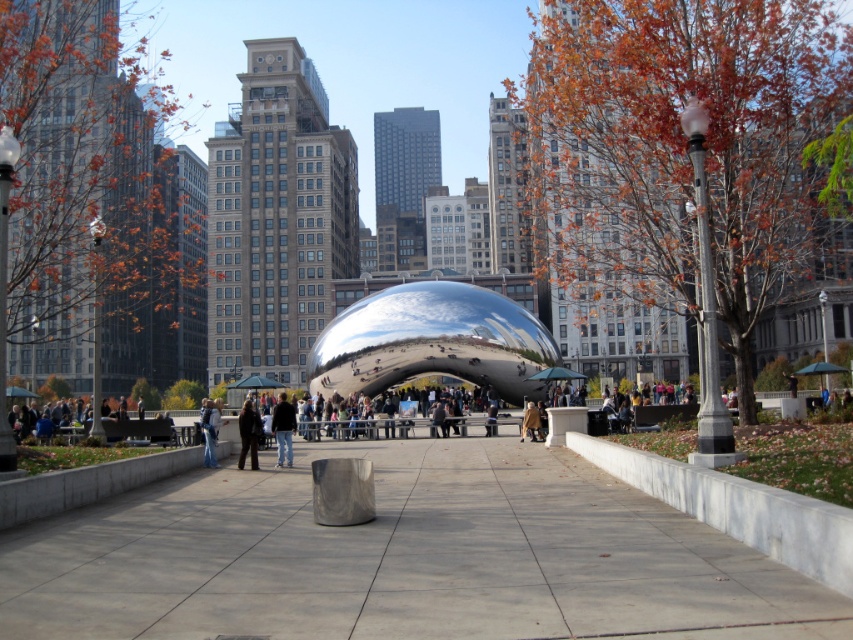
Question: Among these objects, which one is nearest to the camera?

Choices:
 (A) denim jacket at center
 (B) black leather jacket at center
 (C) dark brown leather jacket at center
 (D) gray concrete pavement at center

Answer: (D)

Question: Which of these objects is positioned closest to the black leather jacket at center?

Choices:
 (A) denim jacket at center
 (B) dark brown leather jacket at center
 (C) gray concrete pavement at center

Answer: (B)

Question: Considering the relative positions of black leather jacket at center and denim jacket at center in the image provided, where is black leather jacket at center located with respect to denim jacket at center?

Choices:
 (A) below
 (B) above

Answer: (A)

Question: Is gray concrete pavement at center bigger than black leather jacket at center?

Choices:
 (A) no
 (B) yes

Answer: (A)

Question: Which of these objects is positioned closest to the gray concrete pavement at center?

Choices:
 (A) dark brown leather jacket at center
 (B) black leather jacket at center

Answer: (A)

Question: In this image, where is dark brown leather jacket at center located relative to denim jacket at center?

Choices:
 (A) above
 (B) below

Answer: (A)